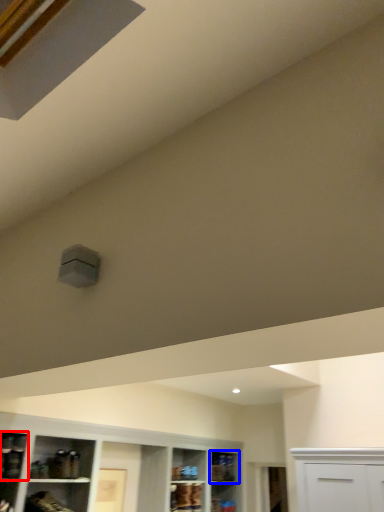
Question: Which object is closer to the camera taking this photo, shelf (highlighted by a red box) or shelf (highlighted by a blue box)?

Choices:
 (A) shelf
 (B) shelf

Answer: (A)